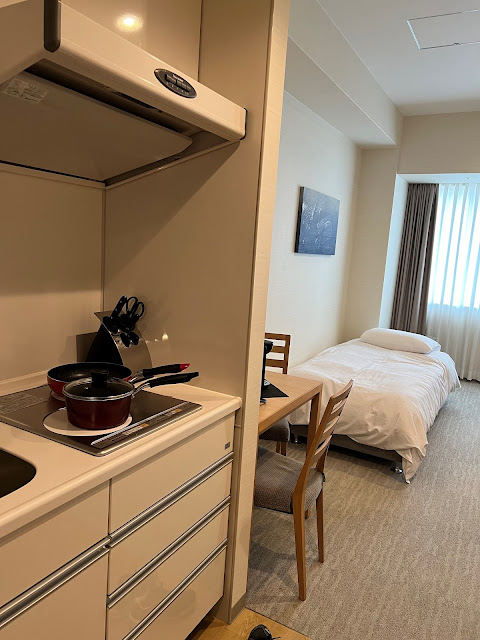
This screenshot has height=640, width=480. Identify the location of art piece. (315, 205).